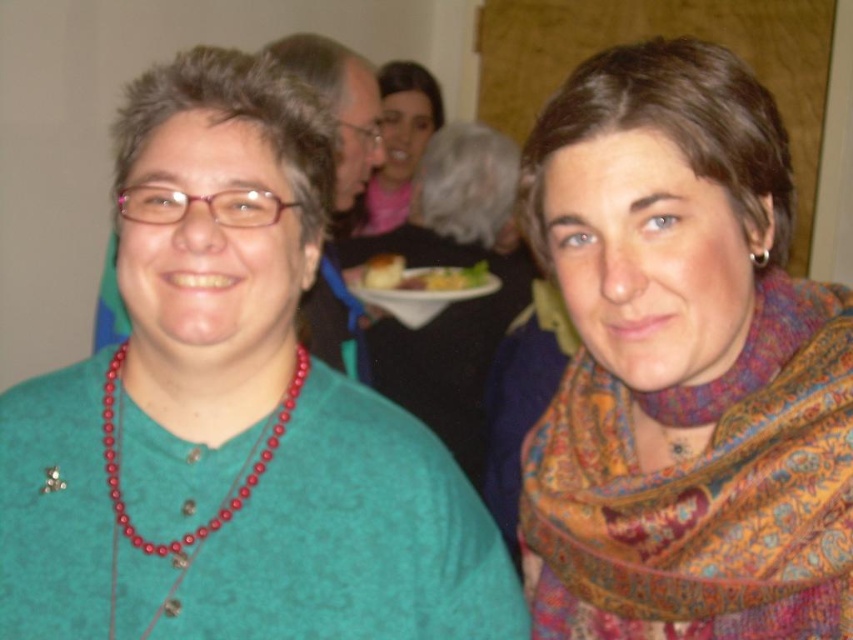
Can you confirm if multicolored scarf at center is positioned above yellow cake at center?

No, multicolored scarf at center is not above yellow cake at center.

Is multicolored scarf at center shorter than yellow cake at center?

No, multicolored scarf at center is not shorter than yellow cake at center.

Is point (462, 147) closer to camera compared to point (398, 278)?

No, (462, 147) is further to viewer.

This screenshot has height=640, width=853. Identify the location of multicolored scarf at center. (453, 301).

Who is taller, floral silk scarf at right or matte red beaded necklace at center?

floral silk scarf at right is taller.

Who is more forward, (843, 516) or (273, 426)?

Point (843, 516)

Measure the distance between floral silk scarf at right and camera.

floral silk scarf at right is 23.37 inches away from camera.

Locate an element on the screen. The image size is (853, 640). floral silk scarf at right is located at coordinates (703, 492).

Is point (552, 433) in front of point (387, 269)?

Yes, it is in front of point (387, 269).

Is floral silk scarf at right bigger than yellow cake at center?

Yes, floral silk scarf at right is bigger than yellow cake at center.

Find the location of `floral silk scarf at right`. floral silk scarf at right is located at coordinates (703, 492).